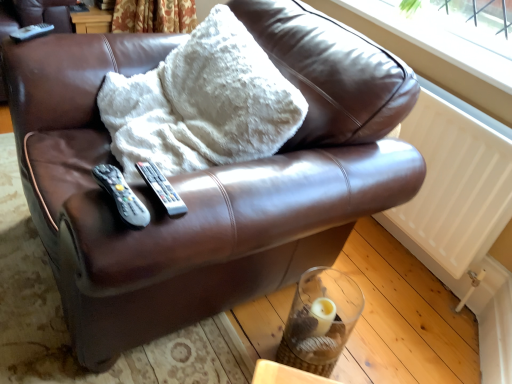
Question: Is black plastic remote at center, the 1th remote when ordered from front to back, surrounding white plastic remote at center, arranged as the 2th remote when viewed from the back?

Choices:
 (A) yes
 (B) no

Answer: (B)

Question: Is black plastic remote at center, marked as the second remote in a left-to-right arrangement, aimed at white plastic remote at center, which appears as the 2th remote when ordered from the bottom?

Choices:
 (A) no
 (B) yes

Answer: (B)

Question: Would you say black plastic remote at center, which is the third remote in back-to-front order, is outside white plastic remote at center, arranged as the 2th remote when viewed from the top?

Choices:
 (A) yes
 (B) no

Answer: (A)

Question: Does black plastic remote at center, the third remote when ordered from top to bottom, appear on the left side of white plastic remote at center, the first remote viewed from the right?

Choices:
 (A) yes
 (B) no

Answer: (A)

Question: Can you confirm if black plastic remote at center, the third remote when ordered from top to bottom, is smaller than white plastic remote at center, positioned as the third remote in left-to-right order?

Choices:
 (A) yes
 (B) no

Answer: (B)

Question: Visually, is white plastic remote at center, arranged as the 2th remote when viewed from the back, positioned to the left or to the right of white matte radiator at lower right?

Choices:
 (A) left
 (B) right

Answer: (A)

Question: From the image's perspective, is white plastic remote at center, which appears as the 2th remote when ordered from the bottom, located above or below white matte radiator at lower right?

Choices:
 (A) below
 (B) above

Answer: (A)

Question: Is white plastic remote at center, positioned as the third remote in left-to-right order, situated inside white matte radiator at lower right or outside?

Choices:
 (A) outside
 (B) inside

Answer: (A)

Question: Considering the positions of white plastic remote at center, the first remote viewed from the right, and white matte radiator at lower right in the image, is white plastic remote at center, the first remote viewed from the right, bigger or smaller than white matte radiator at lower right?

Choices:
 (A) small
 (B) big

Answer: (A)

Question: Considering the positions of black plastic remote at center, the 1th remote when ordered from front to back, and white matte radiator at lower right in the image, is black plastic remote at center, the 1th remote when ordered from front to back, taller or shorter than white matte radiator at lower right?

Choices:
 (A) short
 (B) tall

Answer: (A)

Question: Is black plastic remote at center, the third remote when ordered from top to bottom, wider or thinner than white matte radiator at lower right?

Choices:
 (A) wide
 (B) thin

Answer: (B)

Question: Is black plastic remote at center, the 1th remote when ordered from front to back, in front of or behind white matte radiator at lower right in the image?

Choices:
 (A) behind
 (B) front

Answer: (B)

Question: Is point (132, 192) positioned closer to the camera than point (422, 243)?

Choices:
 (A) farther
 (B) closer

Answer: (B)

Question: Is white plastic window frame at upper right taller or shorter than black plastic remote at center, the third remote when ordered from top to bottom?

Choices:
 (A) short
 (B) tall

Answer: (B)

Question: From the image's perspective, is white plastic window frame at upper right positioned above or below black plastic remote at center, the third remote when ordered from top to bottom?

Choices:
 (A) above
 (B) below

Answer: (A)